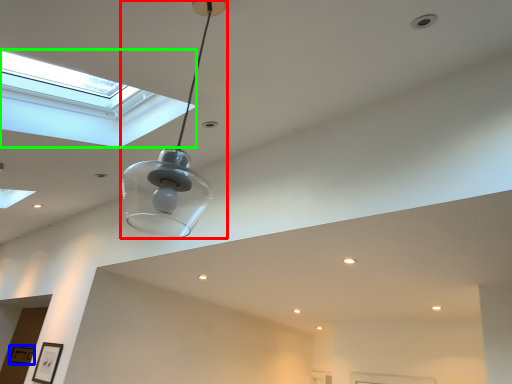
Question: Based on their relative distances, which object is nearer to lamp (highlighted by a red box)? Choose from picture frame (highlighted by a blue box) and window (highlighted by a green box).

Choices:
 (A) picture frame
 (B) window

Answer: (B)